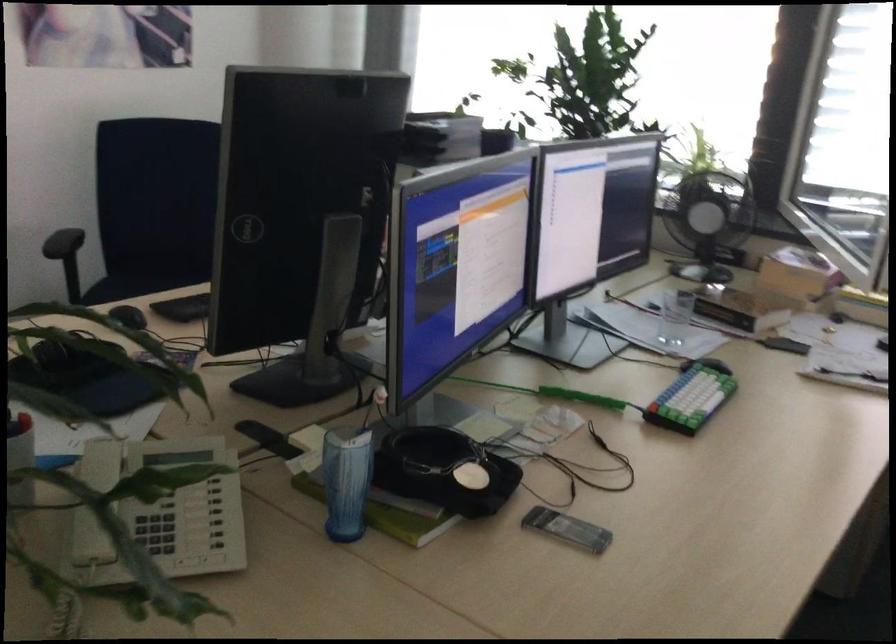
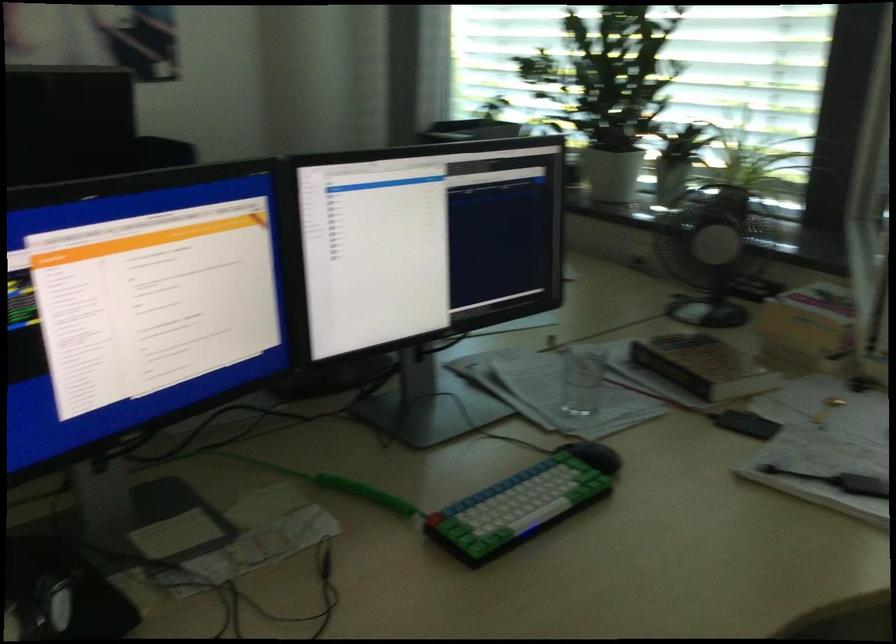
Where in the second image is the point corresponding to (x=803, y=274) from the first image?

(810, 326)